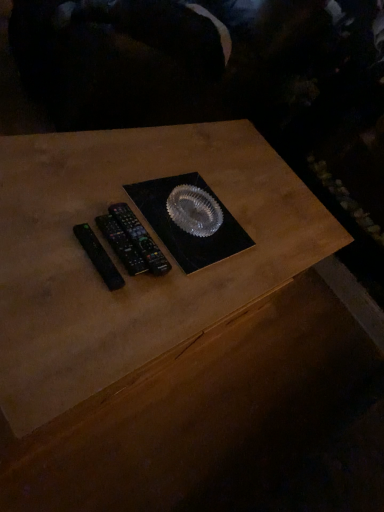
Locate an element on the screen. Image resolution: width=384 pixels, height=512 pixels. free space in front of black plastic remote controls at center, which is the 1th control from back to front is located at coordinates (84, 295).